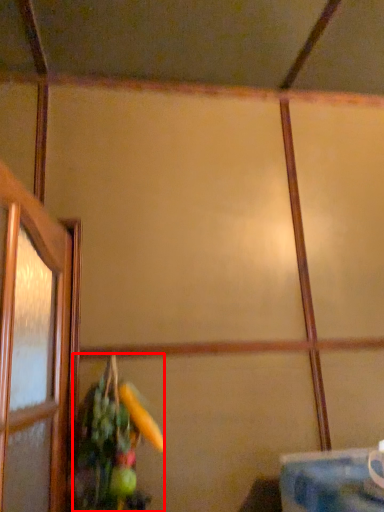
Question: From the image's perspective, where is floral arrangement (annotated by the red box) located in relation to table in the image?

Choices:
 (A) above
 (B) below

Answer: (A)